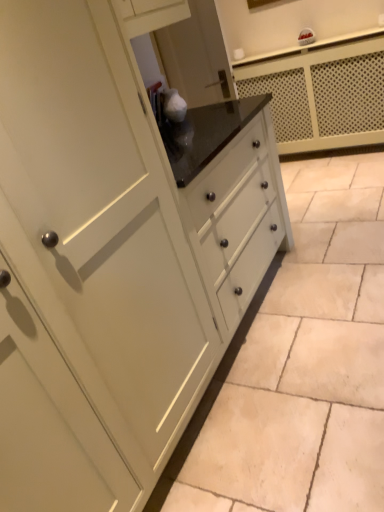
Measure the distance between point (311,370) and camera.

The depth of point (311,370) is 5.84 feet.

This screenshot has height=512, width=384. Describe the element at coordinates (306, 362) in the screenshot. I see `matte white cabinet at center` at that location.

Find the location of `matte white cabinet at center`. matte white cabinet at center is located at coordinates (306, 362).

In order to face matte white cabinet at center, should I rotate leftwards or rightwards?

You should rotate right by 15.028 degrees.

The width and height of the screenshot is (384, 512). Identify the location of white glossy counter at upper center. (322, 94).

What do you see at coordinates (322, 94) in the screenshot? I see `white glossy counter at upper center` at bounding box center [322, 94].

At what (x,y) coordinates should I click in order to perform the action: click on matte white cabinet at center. Please return your answer as a coordinate pair (x, y). The image size is (384, 512). Looking at the image, I should click on (306, 362).

Considering the relative positions of matte white cabinet at center and white glossy counter at upper center in the image provided, is matte white cabinet at center to the left of white glossy counter at upper center from the viewer's perspective?

Correct, you'll find matte white cabinet at center to the left of white glossy counter at upper center.

Which object is further away from the camera, matte white cabinet at center or white glossy counter at upper center?

white glossy counter at upper center is behind.

Which is behind, point (358, 182) or point (281, 79)?

The point (281, 79) is more distant.

From the image's perspective, is matte white cabinet at center positioned above or below white glossy counter at upper center?

matte white cabinet at center is below white glossy counter at upper center.

From a real-world perspective, is matte white cabinet at center under white glossy counter at upper center?

Yes, from a real-world perspective, matte white cabinet at center is under white glossy counter at upper center.

Is matte white cabinet at center wider than white glossy counter at upper center?

Yes, matte white cabinet at center is wider than white glossy counter at upper center.

Is matte white cabinet at center taller than white glossy counter at upper center?

No, matte white cabinet at center is not taller than white glossy counter at upper center.

Looking at the image, does matte white cabinet at center seem bigger or smaller compared to white glossy counter at upper center?

Clearly, matte white cabinet at center is smaller in size than white glossy counter at upper center.

Consider the image. Is white glossy counter at upper center a part of matte white cabinet at center?

No, matte white cabinet at center does not contain white glossy counter at upper center.

Would you consider matte white cabinet at center to be distant from white glossy counter at upper center?

That's right, there is a large distance between matte white cabinet at center and white glossy counter at upper center.

Is matte white cabinet at center looking in the opposite direction of white glossy counter at upper center?

No, matte white cabinet at center is not facing away from white glossy counter at upper center.

There is a matte white cabinet at center. Where is `counter above it (from a real-world perspective)`? counter above it (from a real-world perspective) is located at coordinates (322, 94).

Which object is positioned more to the right, white glossy counter at upper center or matte white cabinet at center?

From the viewer's perspective, white glossy counter at upper center appears more on the right side.

Is white glossy counter at upper center positioned behind matte white cabinet at center?

Yes, the depth of white glossy counter at upper center is greater than that of matte white cabinet at center.

From the picture: Which is further, (274, 106) or (315, 204)?

Point (274, 106)

From the image's perspective, which is above, white glossy counter at upper center or matte white cabinet at center?

white glossy counter at upper center is shown above in the image.

From a real-world perspective, is white glossy counter at upper center positioned under matte white cabinet at center based on gravity?

Actually, white glossy counter at upper center is physically above matte white cabinet at center in the real world.

Is white glossy counter at upper center thinner than matte white cabinet at center?

Yes, white glossy counter at upper center is thinner than matte white cabinet at center.

Which of these two, white glossy counter at upper center or matte white cabinet at center, stands taller?

Standing taller between the two is white glossy counter at upper center.

Considering the sizes of white glossy counter at upper center and matte white cabinet at center in the image, is white glossy counter at upper center bigger or smaller than matte white cabinet at center?

In the image, white glossy counter at upper center appears to be larger than matte white cabinet at center.

Would you say white glossy counter at upper center is inside or outside matte white cabinet at center?

white glossy counter at upper center is spatially situated outside matte white cabinet at center.

Would you consider white glossy counter at upper center to be distant from matte white cabinet at center?

Yes.

Is white glossy counter at upper center facing towards matte white cabinet at center?

Yes.

Identify the location of ceramic tile in front of the white glossy counter at upper center. (306, 362).

Locate an element on the screen. counter located above the matte white cabinet at center (from a real-world perspective) is located at coordinates (322, 94).

Identify the location of counter above the matte white cabinet at center (from the image's perspective). (322, 94).